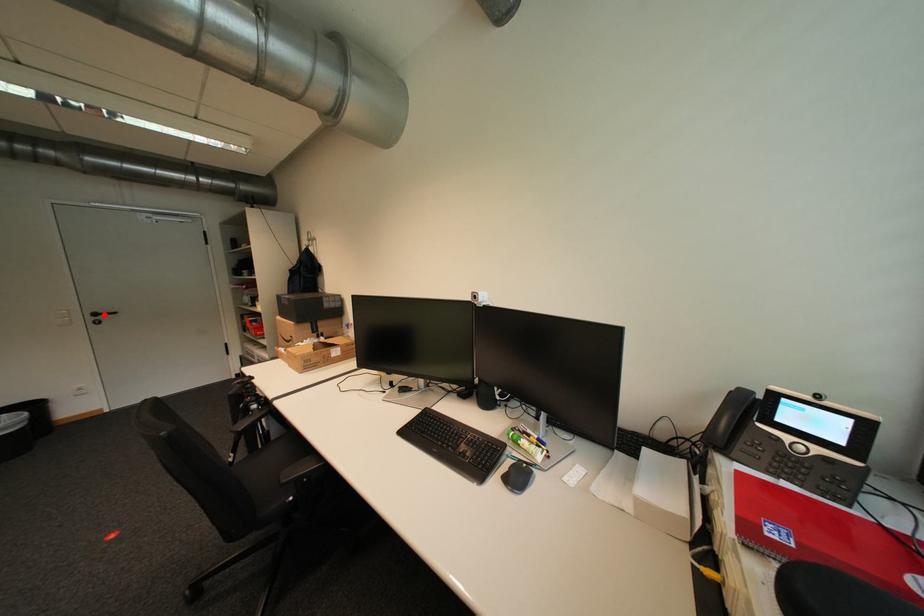
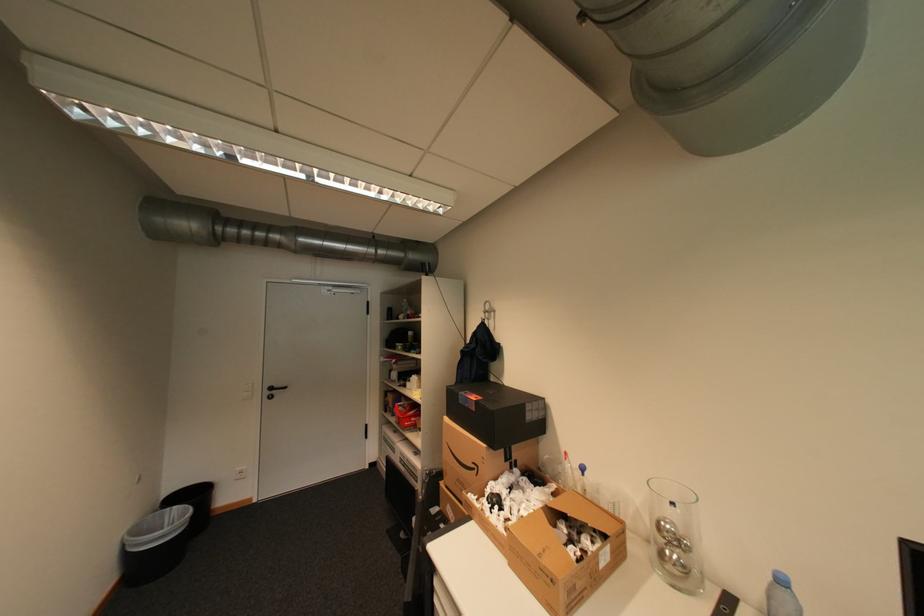
Find the pixel in the second image that matches the highlighted location in the first image.

(280, 389)